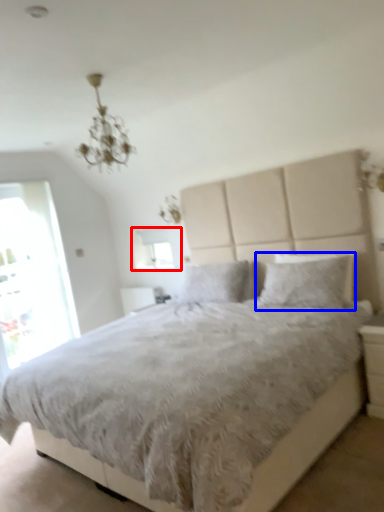
Question: Among these objects, which one is nearest to the camera, window screen (highlighted by a red box) or pillow (highlighted by a blue box)?

Choices:
 (A) window screen
 (B) pillow

Answer: (B)